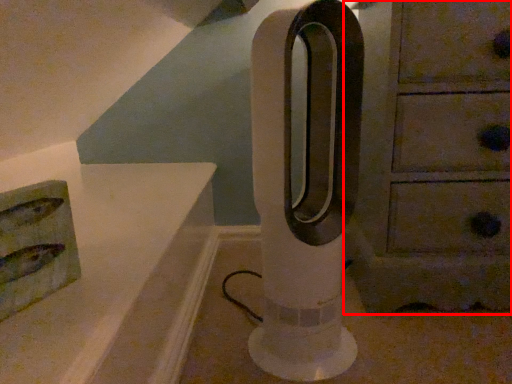
Question: Considering the relative positions of chest of drawers (annotated by the red box) and pillar in the image provided, where is chest of drawers (annotated by the red box) located with respect to the staircase?

Choices:
 (A) left
 (B) right

Answer: (B)